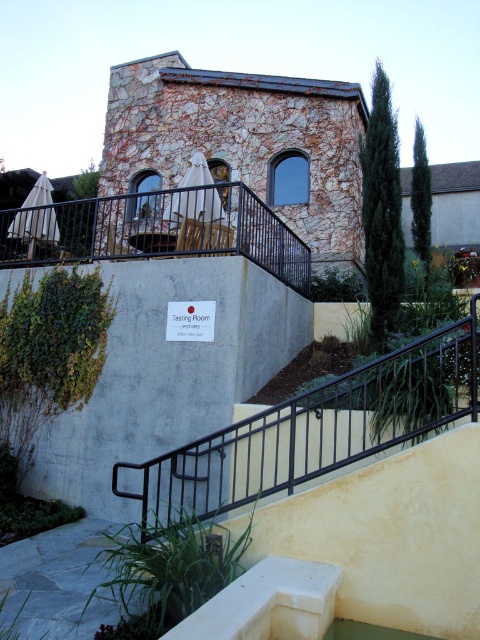
Question: Can you confirm if black metal/rail at lower center is positioned to the left of black metal railing at upper center?

Choices:
 (A) no
 (B) yes

Answer: (A)

Question: Is black metal/rail at lower center below black metal railing at upper center?

Choices:
 (A) yes
 (B) no

Answer: (A)

Question: Does black metal/rail at lower center have a lesser width compared to black metal railing at upper center?

Choices:
 (A) yes
 (B) no

Answer: (B)

Question: Among these objects, which one is farthest from the camera?

Choices:
 (A) black metal/rail at lower center
 (B) black metal railing at upper center

Answer: (B)

Question: Which point appears closest to the camera in this image?

Choices:
 (A) (467, 413)
 (B) (115, 227)

Answer: (A)